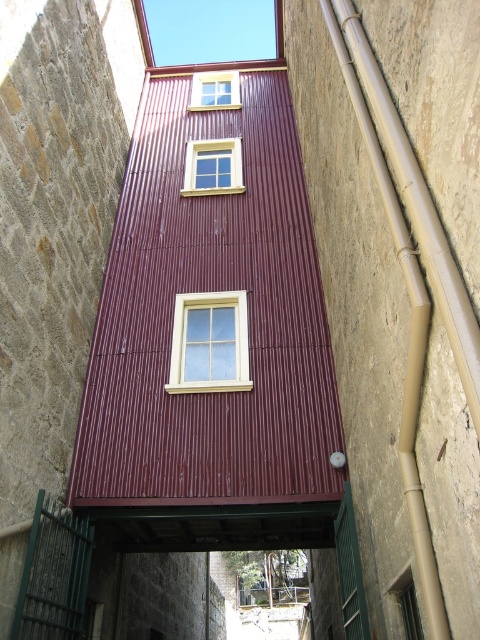
Question: Can you confirm if white wood window at center is bigger than wooden window at center?

Choices:
 (A) no
 (B) yes

Answer: (A)

Question: Which point is closer to the camera?

Choices:
 (A) (205, 81)
 (B) (236, 176)
 (C) (177, 374)

Answer: (C)

Question: Is white wood window at center to the left of wooden window at center from the viewer's perspective?

Choices:
 (A) no
 (B) yes

Answer: (A)

Question: Which object appears closest to the camera in this image?

Choices:
 (A) matte yellow window at upper center
 (B) wooden window at center

Answer: (B)

Question: Can you confirm if white wood window at center is positioned to the right of matte yellow window at upper center?

Choices:
 (A) no
 (B) yes

Answer: (B)

Question: Among these points, which one is nearest to the camera?

Choices:
 (A) (181, 380)
 (B) (199, 188)

Answer: (A)